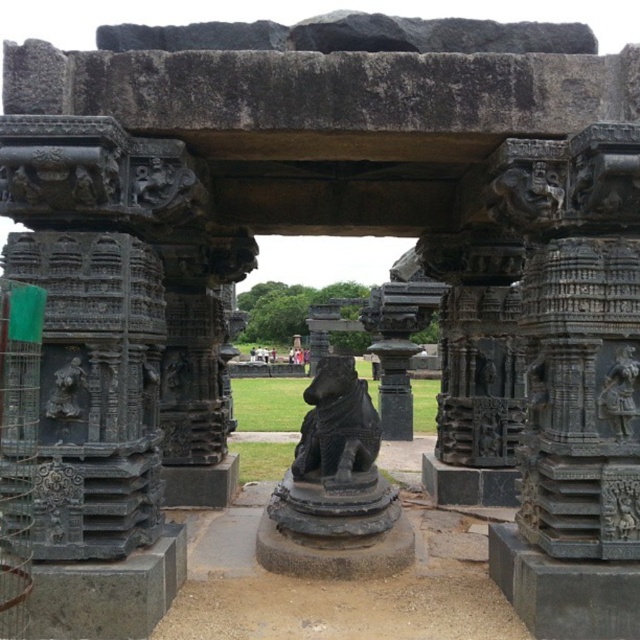
Based on the scene description, where is the dark gray stone carving at center located in terms of its 2D coordinates?

The dark gray stone carving at center is located at the 2D coordinates of point (620, 502).